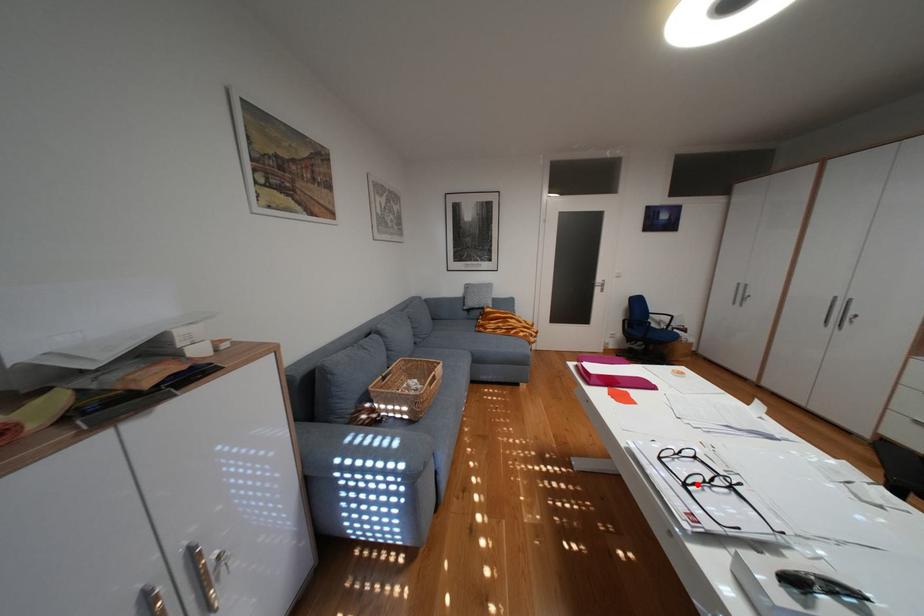
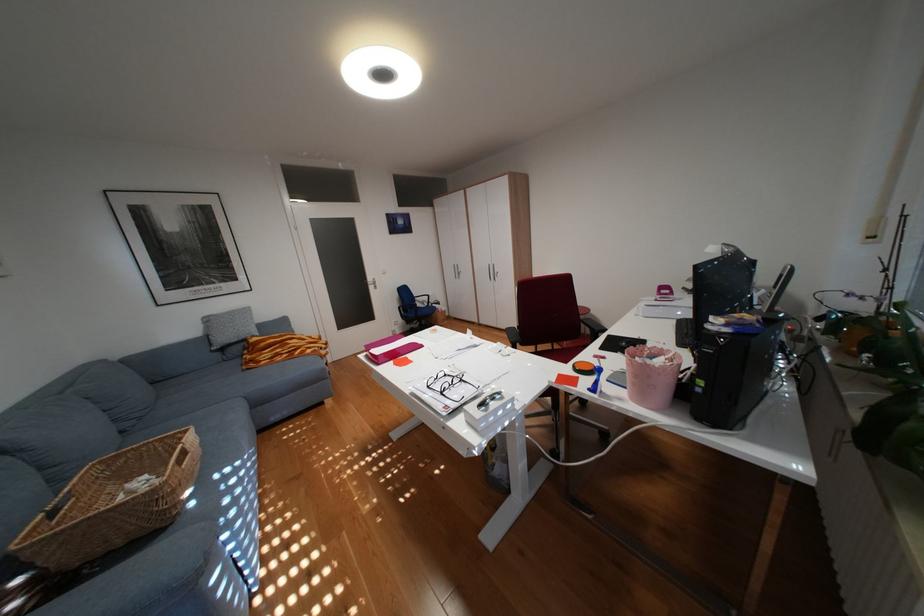
Where in the second image is the point corresponding to the highlighted location from the first image?

(454, 392)